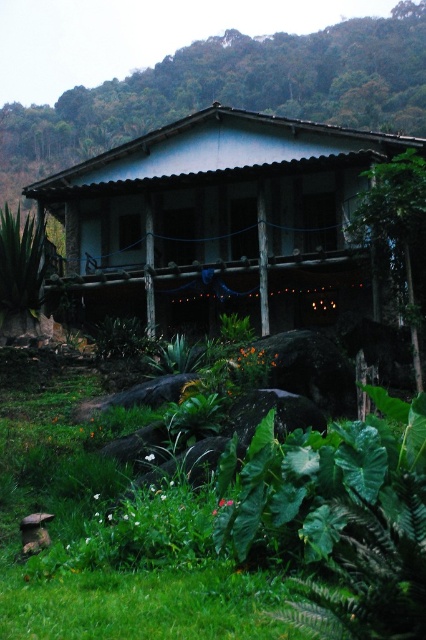
Between point (115, 570) and point (270, 314), which one is positioned behind?

The point (270, 314) is more distant.

Does point (226, 497) come behind point (293, 211)?

No.

Is point (121, 628) positioned behind point (357, 147)?

No, (121, 628) is in front of (357, 147).

You are a GUI agent. You are given a task and a screenshot of the screen. Output one action in this format:
    pyautogui.click(x=<x>, y=<y>)
    Task: Click on the green leafy plant at lower center
    The width and height of the screenshot is (426, 640).
    Given the screenshot: What is the action you would take?
    pyautogui.click(x=181, y=540)